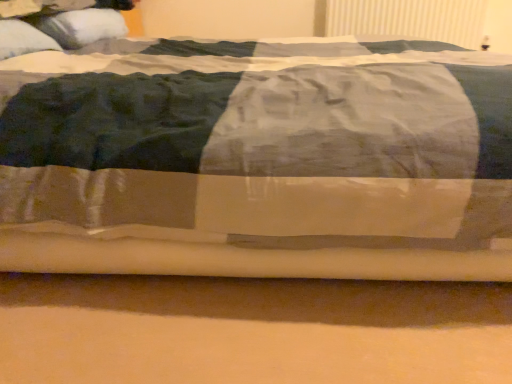
Question: From a real-world perspective, does white soft pillow at upper left, marked as the 1th pillow in a back-to-front arrangement, stand above white textured radiator at upper right?

Choices:
 (A) no
 (B) yes

Answer: (B)

Question: Are white soft pillow at upper left, which appears as the 2th pillow when viewed from the front, and white textured radiator at upper right making contact?

Choices:
 (A) yes
 (B) no

Answer: (B)

Question: Does white soft pillow at upper left, marked as the 1th pillow in a back-to-front arrangement, have a larger size compared to white textured radiator at upper right?

Choices:
 (A) no
 (B) yes

Answer: (B)

Question: Is white soft pillow at upper left, which appears as the 2th pillow when viewed from the front, wider than white textured radiator at upper right?

Choices:
 (A) yes
 (B) no

Answer: (A)

Question: Is white soft pillow at upper left, marked as the 1th pillow in a back-to-front arrangement, facing towards white textured radiator at upper right?

Choices:
 (A) yes
 (B) no

Answer: (A)

Question: In the image, is white soft pillow at upper left, which appears as the 2th pillow when viewed from the front, positioned in front of or behind white textured radiator at upper right?

Choices:
 (A) front
 (B) behind

Answer: (A)

Question: In terms of width, does white soft pillow at upper left, marked as the 1th pillow in a back-to-front arrangement, look wider or thinner when compared to white textured radiator at upper right?

Choices:
 (A) thin
 (B) wide

Answer: (B)

Question: From the image's perspective, is white soft pillow at upper left, marked as the 1th pillow in a back-to-front arrangement, above or below white textured radiator at upper right?

Choices:
 (A) below
 (B) above

Answer: (A)

Question: Which is correct: white soft pillow at upper left, which appears as the 2th pillow when viewed from the front, is inside white textured radiator at upper right, or outside of it?

Choices:
 (A) outside
 (B) inside

Answer: (A)

Question: From the image's perspective, is white soft pillow at upper left, which appears as the 2th pillow when viewed from the front, above or below white soft pillow at upper left, which appears as the second pillow when viewed from the back?

Choices:
 (A) above
 (B) below

Answer: (A)

Question: In the image, is white soft pillow at upper left, which appears as the 2th pillow when viewed from the front, positioned in front of or behind white soft pillow at upper left, which appears as the second pillow when viewed from the back?

Choices:
 (A) behind
 (B) front

Answer: (A)

Question: Looking at their shapes, would you say white soft pillow at upper left, which appears as the 2th pillow when viewed from the front, is wider or thinner than white soft pillow at upper left, the first pillow from the front?

Choices:
 (A) wide
 (B) thin

Answer: (A)

Question: In terms of height, does white soft pillow at upper left, which appears as the 2th pillow when viewed from the front, look taller or shorter compared to white soft pillow at upper left, the first pillow from the front?

Choices:
 (A) short
 (B) tall

Answer: (A)

Question: From a real-world perspective, relative to white soft pillow at upper left, marked as the 1th pillow in a back-to-front arrangement, is white textured radiator at upper right vertically above or below?

Choices:
 (A) below
 (B) above

Answer: (A)

Question: Considering the positions of white textured radiator at upper right and white soft pillow at upper left, marked as the 1th pillow in a back-to-front arrangement, in the image, is white textured radiator at upper right wider or thinner than white soft pillow at upper left, marked as the 1th pillow in a back-to-front arrangement,?

Choices:
 (A) thin
 (B) wide

Answer: (A)